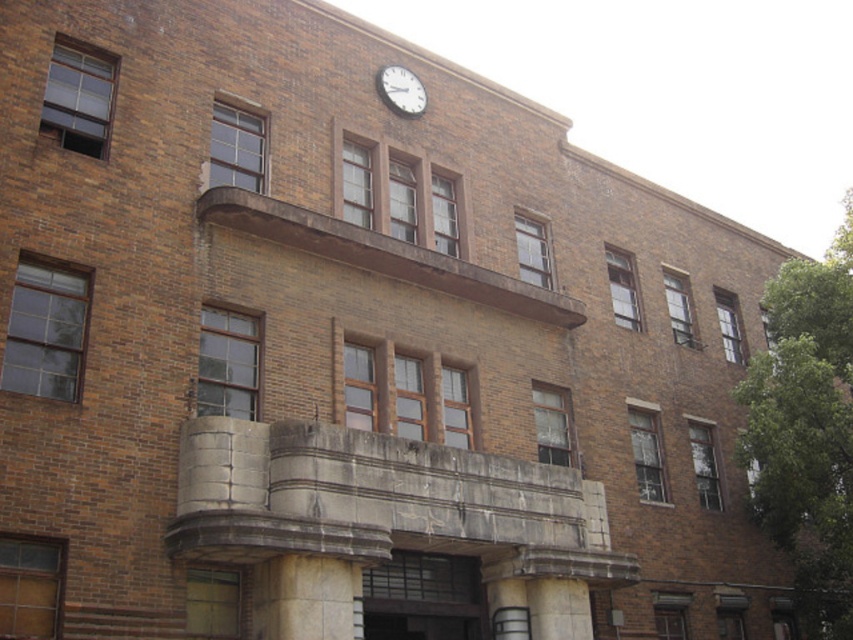
Can you confirm if white marble pillar at center is positioned to the left of white concrete pillar at center?

Indeed, white marble pillar at center is positioned on the left side of white concrete pillar at center.

Does point (287, 625) come in front of point (573, 628)?

Yes.

I want to click on white marble pillar at center, so tap(305, 598).

The height and width of the screenshot is (640, 853). I want to click on white marble pillar at center, so click(x=305, y=598).

Can you confirm if white marble pillar at center is bigger than white matte clock at upper center?

Correct, white marble pillar at center is larger in size than white matte clock at upper center.

Based on the photo, who is shorter, white marble pillar at center or white matte clock at upper center?

Standing shorter between the two is white matte clock at upper center.

Does point (306, 634) come closer to viewer compared to point (398, 102)?

Yes, point (306, 634) is in front of point (398, 102).

Identify the location of white marble pillar at center. (305, 598).

This screenshot has width=853, height=640. What do you see at coordinates (558, 609) in the screenshot?
I see `white concrete pillar at center` at bounding box center [558, 609].

Between point (567, 605) and point (392, 96), which one is positioned behind?

The point (392, 96) is behind.

Is point (556, 596) positioned after point (410, 90)?

No, (556, 596) is in front of (410, 90).

The image size is (853, 640). What are the coordinates of `white concrete pillar at center` in the screenshot? It's located at (558, 609).